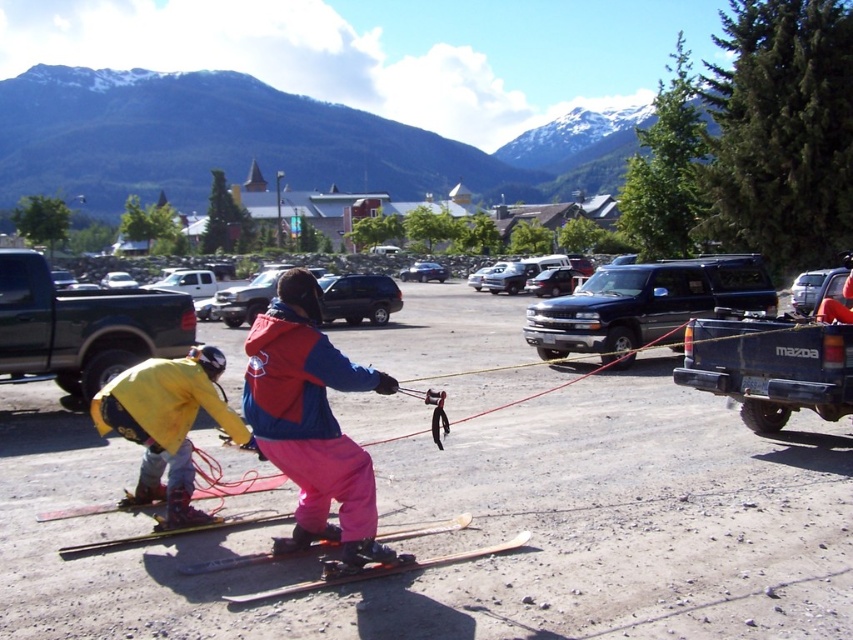
Question: Estimate the real-world distances between objects in this image. Which object is closer to the orange plastic ski at center?

Choices:
 (A) wooden skis at center
 (B) matte black skis at center

Answer: (A)

Question: Which of the following is the farthest from the observer?

Choices:
 (A) matte black skis at center
 (B) yellow matte jacket at lower left
 (C) orange plastic ski at center
 (D) wooden skis at center

Answer: (B)

Question: Does black matte suv at center lie behind shiny black suv at center?

Choices:
 (A) no
 (B) yes

Answer: (A)

Question: Does black matte suv at center have a larger size compared to shiny black suv at center?

Choices:
 (A) yes
 (B) no

Answer: (A)

Question: Which point is farther to the camera?

Choices:
 (A) black matte suv at center
 (B) matte blue and red ski jacket at center
 (C) wooden skis at center

Answer: (A)

Question: Is matte blue and red ski jacket at center below black matte suv at center?

Choices:
 (A) no
 (B) yes

Answer: (B)